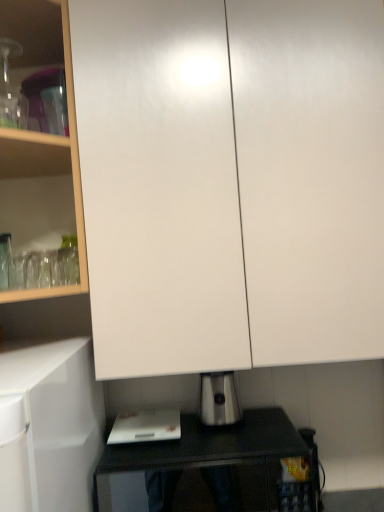
Measure the distance between white plastic cutting board at lower center and camera.

white plastic cutting board at lower center and camera are 1.06 meters apart from each other.

Where is `white glossy cabinet at upper left`? Image resolution: width=384 pixels, height=512 pixels. white glossy cabinet at upper left is located at coordinates (71, 170).

Describe the element at coordinates (71, 170) in the screenshot. I see `white glossy cabinet at upper left` at that location.

What do you see at coordinates (212, 446) in the screenshot?
I see `black glossy table at lower center` at bounding box center [212, 446].

Measure the distance between point (x=207, y=373) and camera.

Point (x=207, y=373) is 3.69 feet away from camera.

Locate an element on the screen. The height and width of the screenshot is (512, 384). satin silver toaster at lower center is located at coordinates (219, 399).

Where is `white glossy cabinet at upper center`? This screenshot has width=384, height=512. white glossy cabinet at upper center is located at coordinates (159, 187).

Which object is closer to the camera taking this photo, white glossy cabinet at upper center or white plastic cutting board at lower center?

Positioned in front is white glossy cabinet at upper center.

Between white glossy cabinet at upper center and white plastic cutting board at lower center, which one has larger size?

Bigger between the two is white glossy cabinet at upper center.

Is point (152, 224) positioned in front of point (140, 424)?

Yes, it is.

Is white glossy cabinet at upper center placed right next to white plastic cutting board at lower center?

No, white glossy cabinet at upper center is not making contact with white plastic cutting board at lower center.

Is white plastic cutting board at lower center next to black glossy table at lower center and touching it?

white plastic cutting board at lower center and black glossy table at lower center are not in contact.

Identify the location of home appliance that appears behind the black glossy table at lower center. (145, 426).

Is white plastic cutting board at lower center outside of black glossy table at lower center?

white plastic cutting board at lower center lies outside black glossy table at lower center's area.

From a real-world perspective, does satin silver toaster at lower center sit lower than black glossy table at lower center?

No.

From the image's perspective, is satin silver toaster at lower center located beneath black glossy table at lower center?

Actually, satin silver toaster at lower center appears above black glossy table at lower center in the image.

Looking at this image, are satin silver toaster at lower center and black glossy table at lower center far apart?

They are positioned close to each other.

How many degrees apart are the facing directions of satin silver toaster at lower center and black glossy table at lower center?

The facing directions of satin silver toaster at lower center and black glossy table at lower center are 0.124 degrees apart.

Is satin silver toaster at lower center aimed at white plastic cutting board at lower center?

No, satin silver toaster at lower center is not turned towards white plastic cutting board at lower center.

Could you measure the distance between satin silver toaster at lower center and white plastic cutting board at lower center?

14.62 centimeters.

Can you confirm if satin silver toaster at lower center is smaller than white plastic cutting board at lower center?

No.

In terms of width, does satin silver toaster at lower center look wider or thinner when compared to white plastic cutting board at lower center?

Clearly, satin silver toaster at lower center has less width compared to white plastic cutting board at lower center.

Does point (166, 413) come in front of point (202, 389)?

No, (166, 413) is behind (202, 389).

Looking at this image, is the position of white plastic cutting board at lower center more distant than that of satin silver toaster at lower center?

No, white plastic cutting board at lower center is in front of satin silver toaster at lower center.

Looking at this image, is there a large distance between white plastic cutting board at lower center and satin silver toaster at lower center?

They are positioned close to each other.

Considering the sizes of white plastic cutting board at lower center and satin silver toaster at lower center in the image, is white plastic cutting board at lower center wider or thinner than satin silver toaster at lower center?

In the image, white plastic cutting board at lower center appears to be wider than satin silver toaster at lower center.

Considering the sizes of white plastic cutting board at lower center and white glossy cabinet at upper left in the image, is white plastic cutting board at lower center taller or shorter than white glossy cabinet at upper left?

Clearly, white plastic cutting board at lower center is shorter compared to white glossy cabinet at upper left.

Is white plastic cutting board at lower center far away from white glossy cabinet at upper left?

No, white plastic cutting board at lower center is not far away from white glossy cabinet at upper left.

Is point (141, 414) closer to camera compared to point (76, 208)?

No, it is behind (76, 208).

From the image's perspective, between white glossy cabinet at upper left and white glossy cabinet at upper center, who is located below?

white glossy cabinet at upper center appears lower in the image.

From a real-world perspective, between white glossy cabinet at upper left and white glossy cabinet at upper center, who is vertically higher?

white glossy cabinet at upper left is physically above.

Considering the sizes of objects white glossy cabinet at upper left and white glossy cabinet at upper center in the image provided, who is smaller, white glossy cabinet at upper left or white glossy cabinet at upper center?

Smaller between the two is white glossy cabinet at upper left.

Can you confirm if white glossy cabinet at upper left is positioned to the left of white glossy cabinet at upper center?

Yes.

The height and width of the screenshot is (512, 384). I want to click on home appliance on the left side of white glossy cabinet at upper center, so click(x=145, y=426).

This screenshot has height=512, width=384. Identify the location of home appliance lying behind the black glossy table at lower center. (145, 426).

Considering their positions, is white glossy cabinet at upper left positioned further to white plastic cutting board at lower center than satin silver toaster at lower center?

white glossy cabinet at upper left is positioned further to the anchor white plastic cutting board at lower center.

Looking at the image, which one is located further to white glossy cabinet at upper center, white plastic cutting board at lower center or white glossy cabinet at upper left?

Among the two, white plastic cutting board at lower center is located further to white glossy cabinet at upper center.

From the image, which object appears to be nearer to black glossy table at lower center, white glossy cabinet at upper center or satin silver toaster at lower center?

satin silver toaster at lower center is closer to black glossy table at lower center.

From the image, which object appears to be nearer to black glossy table at lower center, white plastic cutting board at lower center or white glossy cabinet at upper left?

white plastic cutting board at lower center lies closer to black glossy table at lower center than the other object.

From the image, which object appears to be farther from white glossy cabinet at upper center, satin silver toaster at lower center or white plastic cutting board at lower center?

Among the two, white plastic cutting board at lower center is located further to white glossy cabinet at upper center.

From the picture: Which object lies further to the anchor point white glossy cabinet at upper center, satin silver toaster at lower center or black glossy table at lower center?

black glossy table at lower center is positioned further to the anchor white glossy cabinet at upper center.

Which object lies nearer to the anchor point satin silver toaster at lower center, white glossy cabinet at upper center or white glossy cabinet at upper left?

Based on the image, white glossy cabinet at upper center appears to be nearer to satin silver toaster at lower center.

From the image, which object appears to be farther from white glossy cabinet at upper left, black glossy table at lower center or white glossy cabinet at upper center?

black glossy table at lower center lies further to white glossy cabinet at upper left than the other object.

Find the location of a particular element. kitchen appliance that lies between white glossy cabinet at upper left and black glossy table at lower center from top to bottom is located at coordinates (219, 399).

Image resolution: width=384 pixels, height=512 pixels. Find the location of `table situated between white plastic cutting board at lower center and satin silver toaster at lower center from left to right`. table situated between white plastic cutting board at lower center and satin silver toaster at lower center from left to right is located at coordinates (212, 446).

At what (x,y) coordinates should I click in order to perform the action: click on glass door that lies between white glossy cabinet at upper left and white plastic cutting board at lower center from top to bottom. Please return your answer as a coordinate pair (x, y). Looking at the image, I should click on (159, 187).

The height and width of the screenshot is (512, 384). I want to click on kitchen appliance between white glossy cabinet at upper left and white plastic cutting board at lower center in the vertical direction, so click(x=219, y=399).